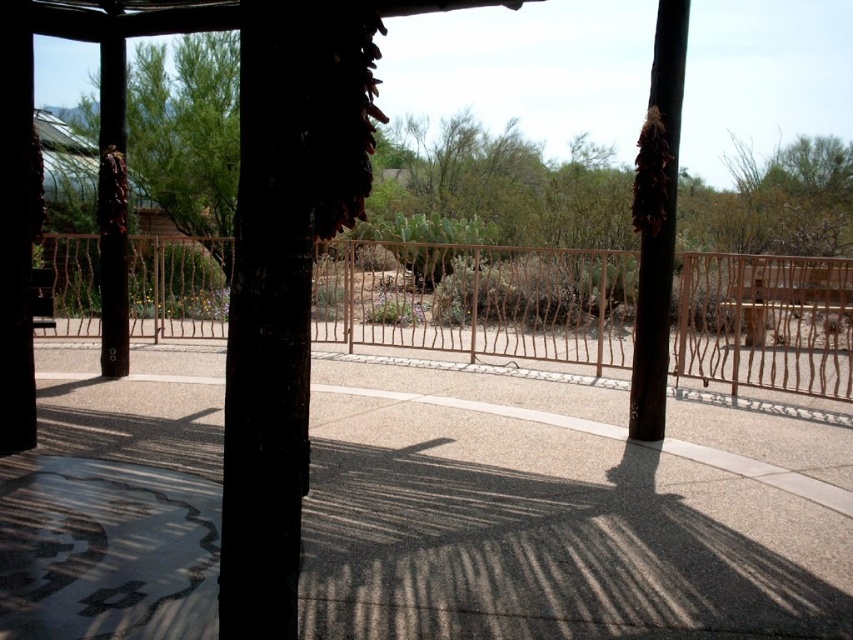
Can you confirm if rustic wood fence at center is wider than brown wood pole at left?

Yes, rustic wood fence at center is wider than brown wood pole at left.

In the scene shown: Is rustic wood fence at center positioned behind brown wood pole at left?

No, it is not.

Which is behind, point (700, 304) or point (120, 243)?

Point (700, 304)

Where is `rustic wood fence at center`? rustic wood fence at center is located at coordinates (479, 300).

Looking at this image, between brown rough wood pole at right and brown wood pole at left, which one has less height?

With less height is brown rough wood pole at right.

Who is more forward, (660, 33) or (120, 326)?

Positioned in front is point (660, 33).

Identify the location of brown rough wood pole at right. Image resolution: width=853 pixels, height=640 pixels. (656, 220).

Does rustic wood fence at center appear under brown rough wood pole at right?

Yes, rustic wood fence at center is below brown rough wood pole at right.

Between point (225, 289) and point (639, 400), which one is positioned in front?

Point (639, 400) is in front.

I want to click on rustic wood fence at center, so click(x=479, y=300).

You are a GUI agent. You are given a task and a screenshot of the screen. Output one action in this format:
    pyautogui.click(x=<x>, y=<y>)
    Task: Click on the rustic wood fence at center
    
    Given the screenshot: What is the action you would take?
    pyautogui.click(x=479, y=300)